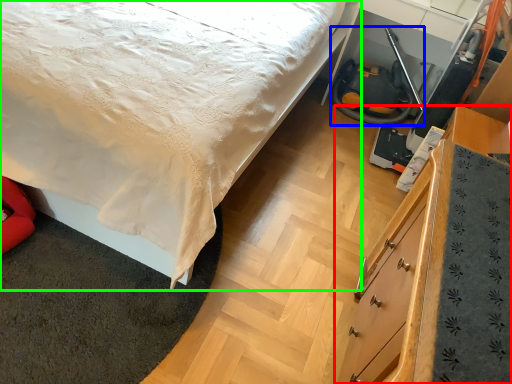
Question: Based on their relative distances, which object is farther from chest of drawers (highlighted by a red box)? Choose from fire hose (highlighted by a blue box) and bed (highlighted by a green box).

Choices:
 (A) fire hose
 (B) bed

Answer: (A)